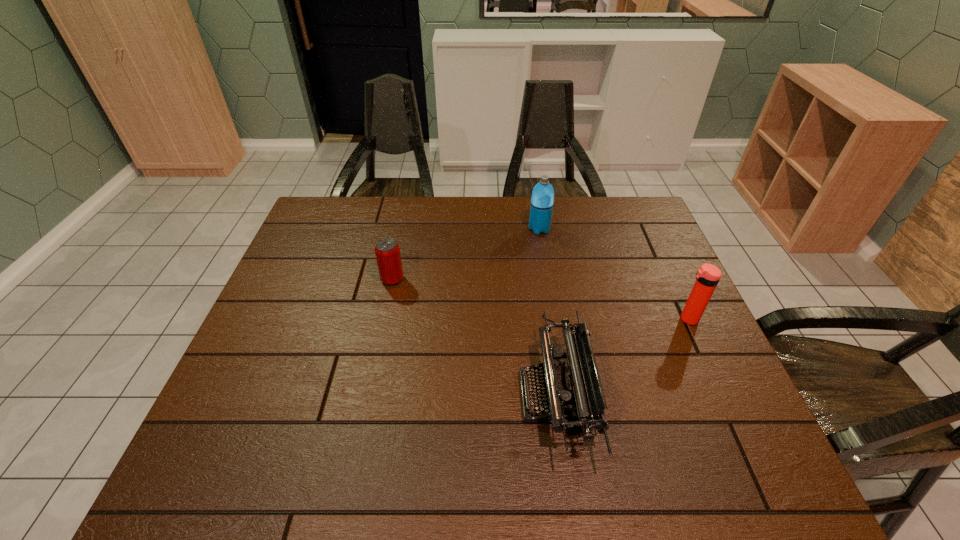
Find the location of `the farthest object`. the farthest object is located at coordinates (542, 199).

Where is `the farther thermos bottle`? This screenshot has height=540, width=960. the farther thermos bottle is located at coordinates (542, 199).

The height and width of the screenshot is (540, 960). Find the location of `the right thermos bottle`. the right thermos bottle is located at coordinates (707, 277).

What are the coordinates of `the rightmost object` in the screenshot? It's located at (707, 277).

At what (x,y) coordinates should I click in order to perform the action: click on the third nearest object. Please return your answer as a coordinate pair (x, y). Looking at the image, I should click on (387, 251).

The height and width of the screenshot is (540, 960). In order to click on the leftmost object in this screenshot , I will do `click(387, 251)`.

Identify the location of the nearest object. click(x=573, y=395).

Find the location of a particular element. The height and width of the screenshot is (540, 960). vacant space situated on the right of the left thermos bottle is located at coordinates (609, 229).

Identify the location of blank space located on the back of the right thermos bottle. (662, 263).

Where is `vacant space situated 0.190m on the left of the third nearest object`? vacant space situated 0.190m on the left of the third nearest object is located at coordinates (315, 279).